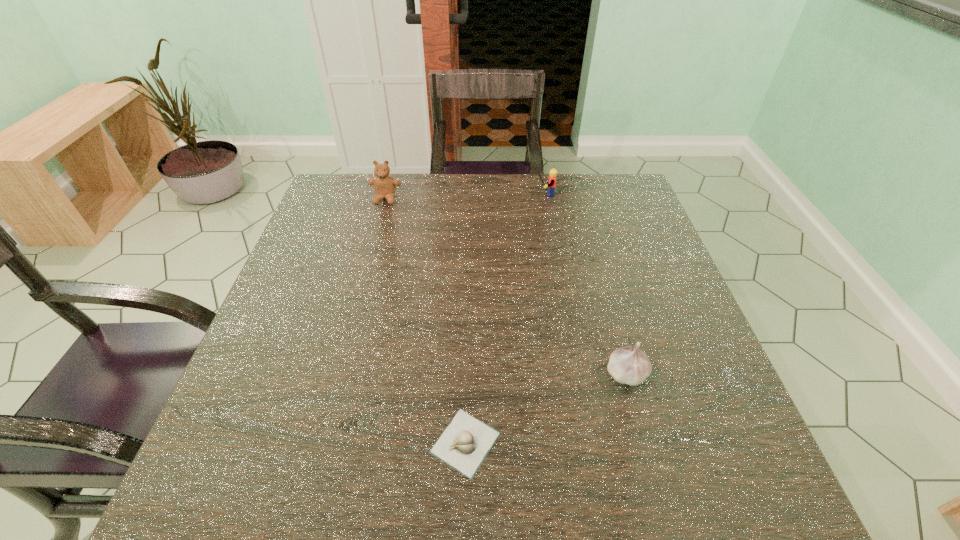
This screenshot has width=960, height=540. I want to click on vacant space that satisfies the following two spatial constraints: 1. on the front-facing side of the third object from left to right; 2. on the face of the teddy bear, so click(x=543, y=199).

Where is `vacant point that satisfies the following two spatial constraints: 1. on the front-facing side of the Lego; 2. on the left side of the second shortest object`? The height and width of the screenshot is (540, 960). vacant point that satisfies the following two spatial constraints: 1. on the front-facing side of the Lego; 2. on the left side of the second shortest object is located at coordinates (576, 374).

I want to click on vacant space that satisfies the following two spatial constraints: 1. on the face of the third farthest object; 2. on the left side of the leftmost object, so click(338, 374).

Identify the location of free space that satisfies the following two spatial constraints: 1. on the face of the second shortest object; 2. on the left side of the teddy bear. The height and width of the screenshot is (540, 960). (338, 374).